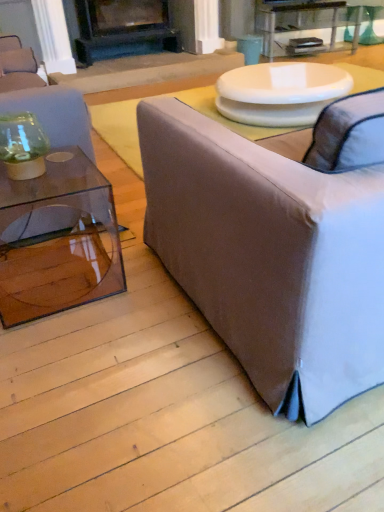
Question: Considering the relative positions of clear glass table at upper center and transparent glass coffee table at left in the image provided, is clear glass table at upper center to the left of transparent glass coffee table at left from the viewer's perspective?

Choices:
 (A) no
 (B) yes

Answer: (A)

Question: Can you confirm if clear glass table at upper center is shorter than transparent glass coffee table at left?

Choices:
 (A) yes
 (B) no

Answer: (B)

Question: Is clear glass table at upper center far away from transparent glass coffee table at left?

Choices:
 (A) no
 (B) yes

Answer: (B)

Question: Is clear glass table at upper center positioned with its back to transparent glass coffee table at left?

Choices:
 (A) no
 (B) yes

Answer: (A)

Question: Can you confirm if clear glass table at upper center is taller than transparent glass coffee table at left?

Choices:
 (A) no
 (B) yes

Answer: (B)

Question: Does clear glass table at upper center lie behind transparent glass coffee table at left?

Choices:
 (A) yes
 (B) no

Answer: (A)

Question: Does light gray fabric couch at right, acting as the 1th studio couch starting from the right, come in front of clear glass table at upper center?

Choices:
 (A) yes
 (B) no

Answer: (A)

Question: Is light gray fabric couch at right, acting as the 1th studio couch starting from the right, at the left side of clear glass table at upper center?

Choices:
 (A) yes
 (B) no

Answer: (A)

Question: Does light gray fabric couch at right, acting as the 1th studio couch starting from the right, have a greater width compared to clear glass table at upper center?

Choices:
 (A) no
 (B) yes

Answer: (B)

Question: From the image's perspective, is light gray fabric couch at right, acting as the 1th studio couch starting from the right, beneath clear glass table at upper center?

Choices:
 (A) yes
 (B) no

Answer: (A)

Question: Is light gray fabric couch at right, the second studio couch in the left-to-right sequence, thinner than clear glass table at upper center?

Choices:
 (A) yes
 (B) no

Answer: (B)

Question: Is light gray fabric couch at right, acting as the 1th studio couch starting from the right, bigger than clear glass table at upper center?

Choices:
 (A) yes
 (B) no

Answer: (A)

Question: From the image's perspective, is black matte fireplace at upper center on white glossy table at upper center?

Choices:
 (A) yes
 (B) no

Answer: (A)